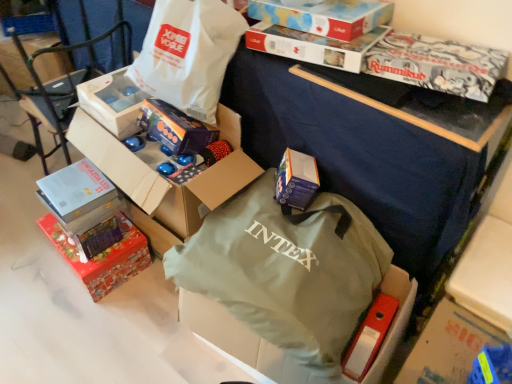
You are a GUI agent. You are given a task and a screenshot of the screen. Output one action in this format:
    pyautogui.click(x=<x>, y=<y>)
    Task: Click on the vacant area to the left of matte cardboard box at left
    The height and width of the screenshot is (384, 512).
    Given the screenshot: What is the action you would take?
    pyautogui.click(x=22, y=167)